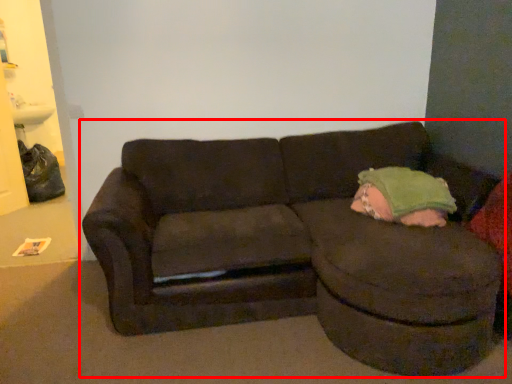
Question: Considering the relative positions of studio couch (annotated by the red box) and toddler in the image provided, where is studio couch (annotated by the red box) located with respect to the staircase?

Choices:
 (A) right
 (B) left

Answer: (B)